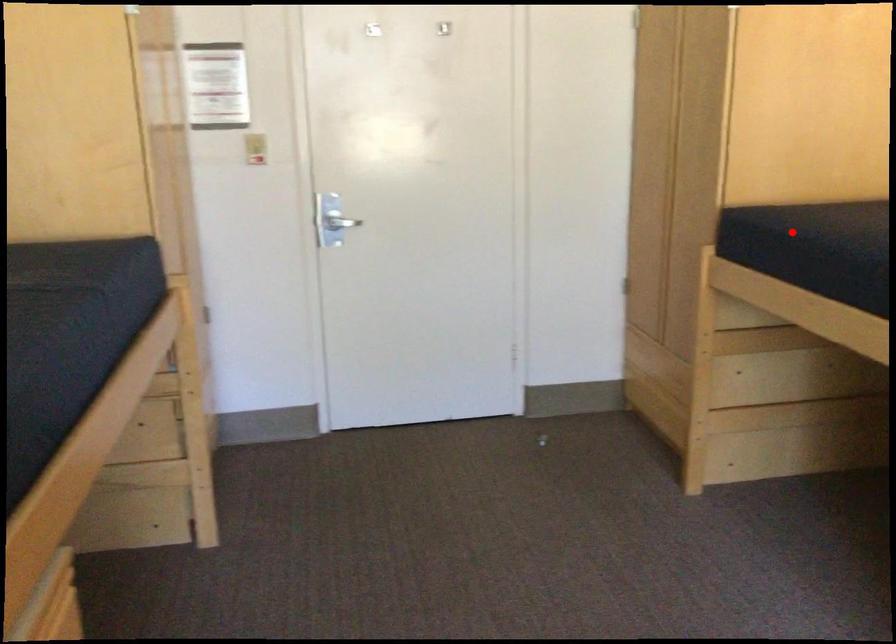
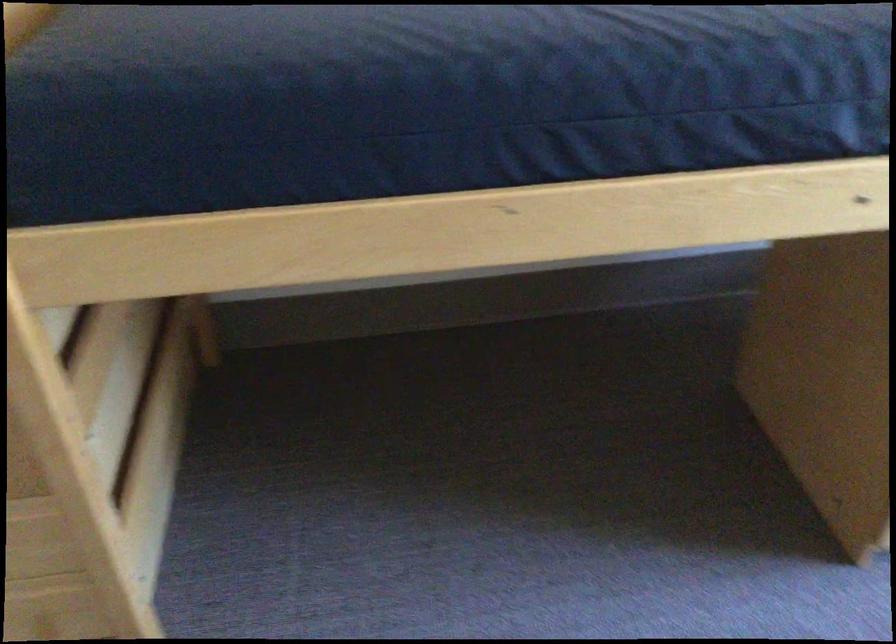
Question: I am providing you with two images of the same scene from different viewpoints. A red point is shown in image1. For the corresponding object point in image2, is it positioned nearer or farther from the camera?

Choices:
 (A) Nearer
 (B) Farther

Answer: (A)